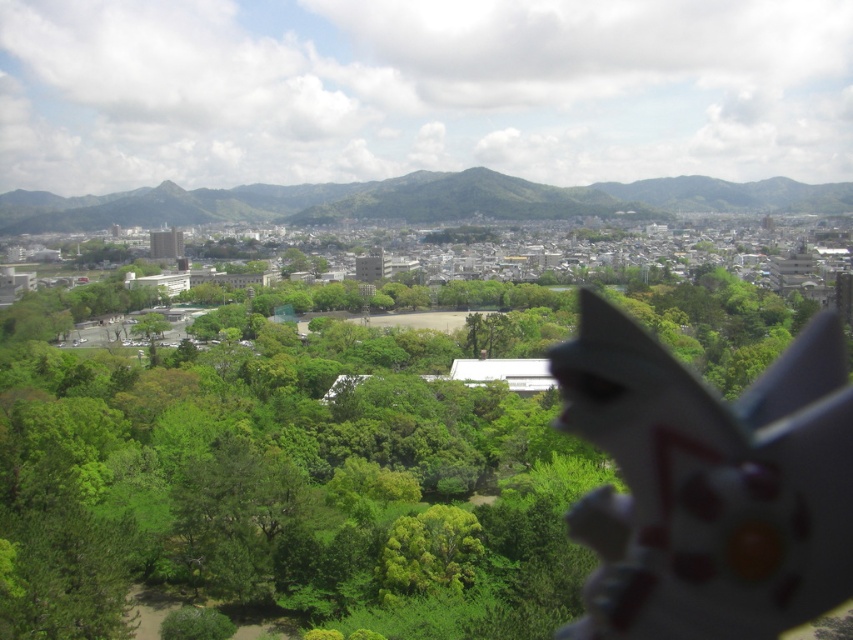
Who is taller, green leafy tree at center or green textured mountain at upper center?

green leafy tree at center

Does point (567, 442) come closer to viewer compared to point (561, 212)?

Yes, point (567, 442) is in front of point (561, 212).

Which is in front, point (444, 563) or point (526, 209)?

Point (444, 563)

What are the coordinates of `green leafy tree at center` in the screenshot? It's located at (425, 490).